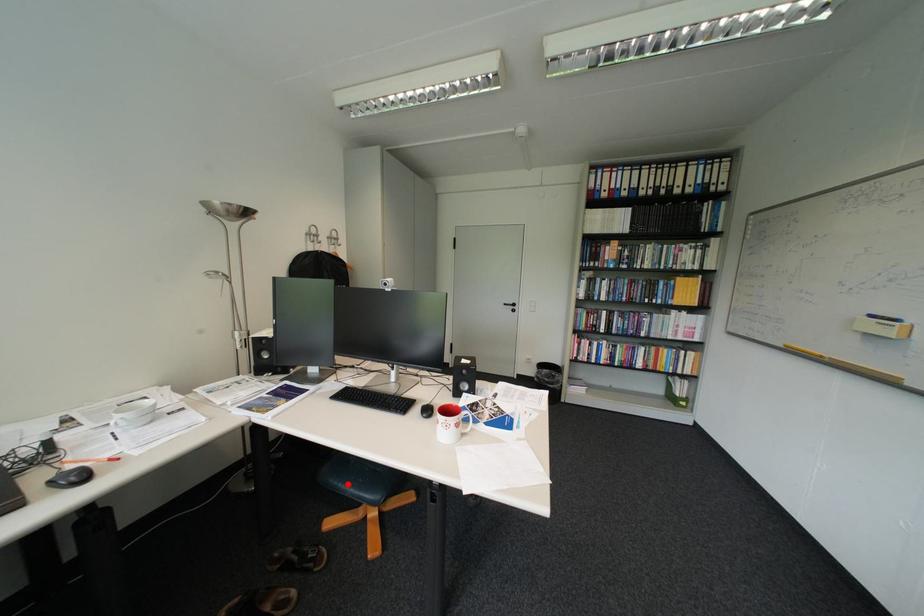
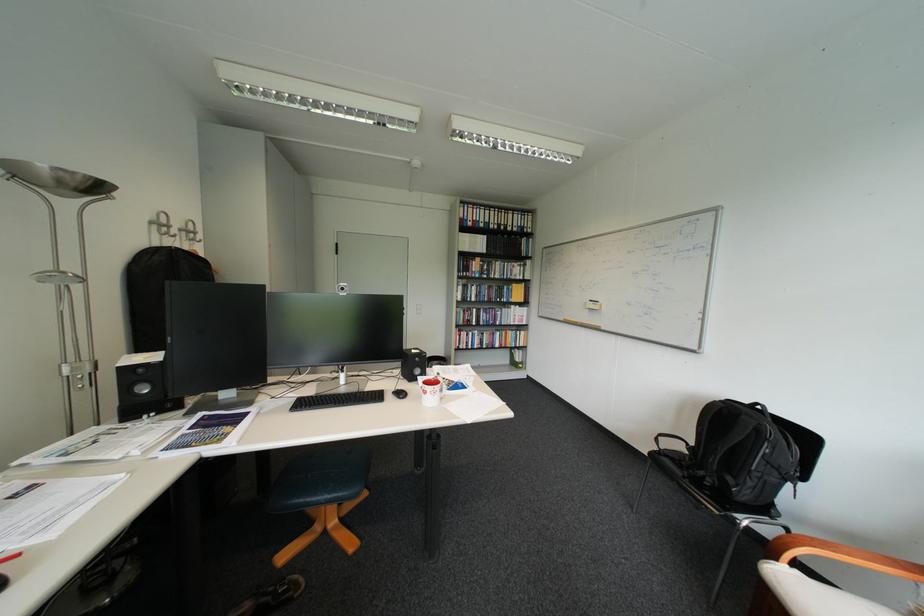
The point at the highlighted location is marked in the first image. Where is the corresponding point in the second image?

(313, 501)